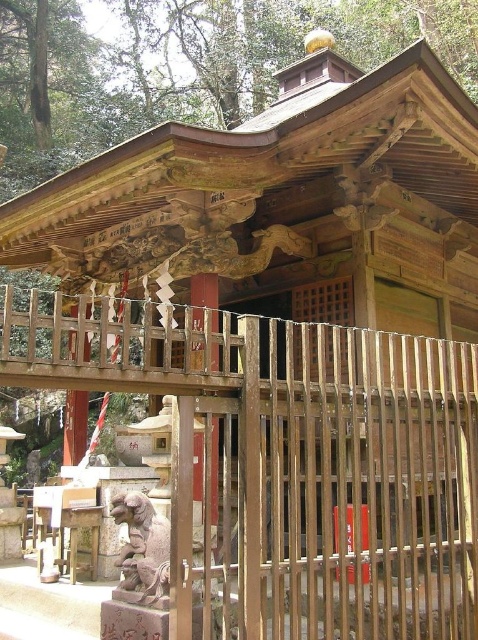
You are standing in front of the traditional Japanese shrine and notice the brown wooden pillar at center and the white painted wood at left. From your perspective, which object is positioned higher?

The brown wooden pillar at center is positioned higher than the white painted wood at left according to the description.

You are standing at the entrance of the shrine and want to reach the golden finial at the roof peak. You notice two points marked on the ground as point 1 and point 2. Point 1 is at coordinate (199, 282) and point 2 is at (79, 390). Which point should you step on to get closer to the golden finial?

Point 1 at coordinate (199, 282) is behind point 2 at (79, 390), so stepping on point 1 would place you closer to the golden finial since it is positioned further back towards the shrine structure.